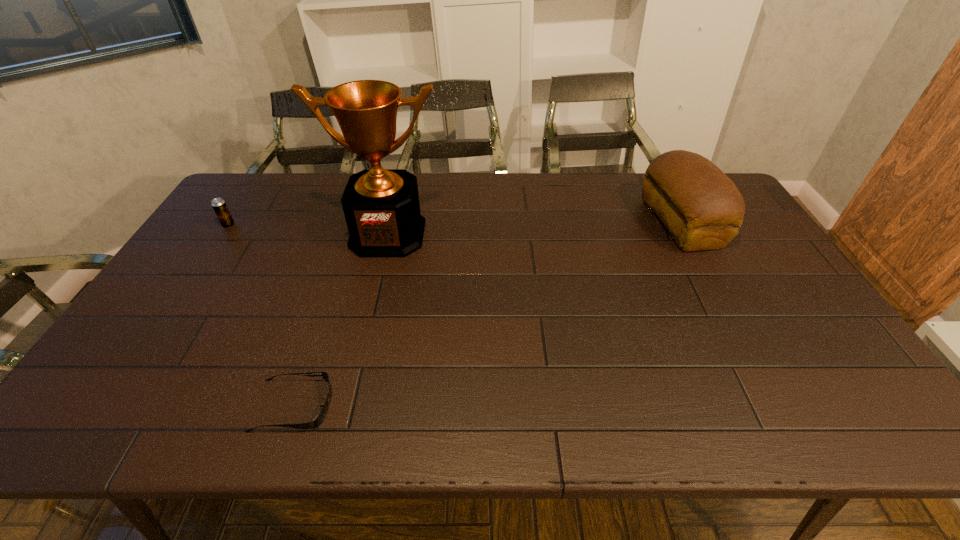
Where is `object that ranks as the second closest to the trophy cup`? object that ranks as the second closest to the trophy cup is located at coordinates (320, 417).

This screenshot has height=540, width=960. Identify the location of free space in the image that satisfies the following two spatial constraints: 1. on the front of the tallest object with the label; 2. on the front-facing side of the sunglasses. (347, 406).

I want to click on free spot that satisfies the following two spatial constraints: 1. on the front side of the rightmost object; 2. on the front-facing side of the sunglasses, so click(780, 406).